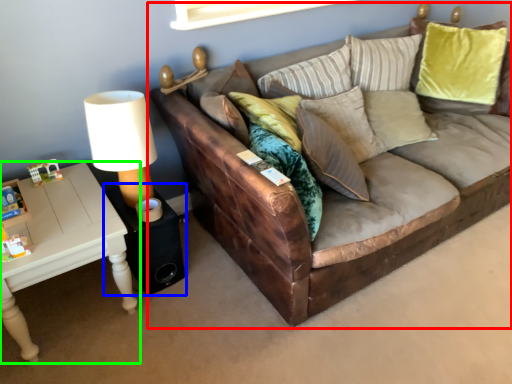
Question: Which is farther away from studio couch (highlighted by a red box)? side table (highlighted by a blue box) or table (highlighted by a green box)?

Choices:
 (A) side table
 (B) table

Answer: (B)